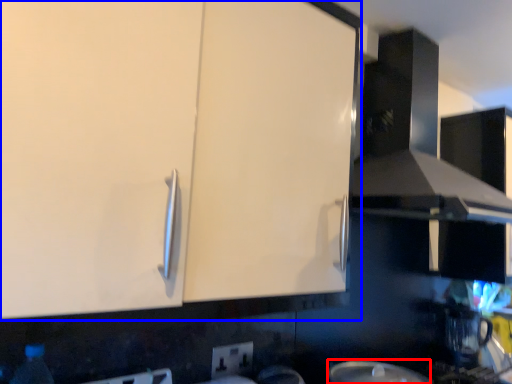
Question: Which of the following is the closest to the observer, appliance (highlighted by a red box) or cabinetry (highlighted by a blue box)?

Choices:
 (A) appliance
 (B) cabinetry

Answer: (B)